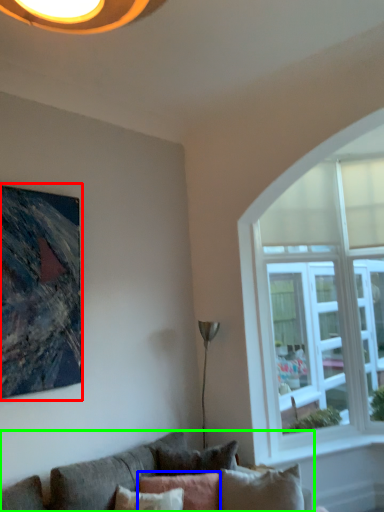
Question: Which is farther away from picture frame (highlighted by a red box)? pillow (highlighted by a blue box) or studio couch (highlighted by a green box)?

Choices:
 (A) pillow
 (B) studio couch

Answer: (A)